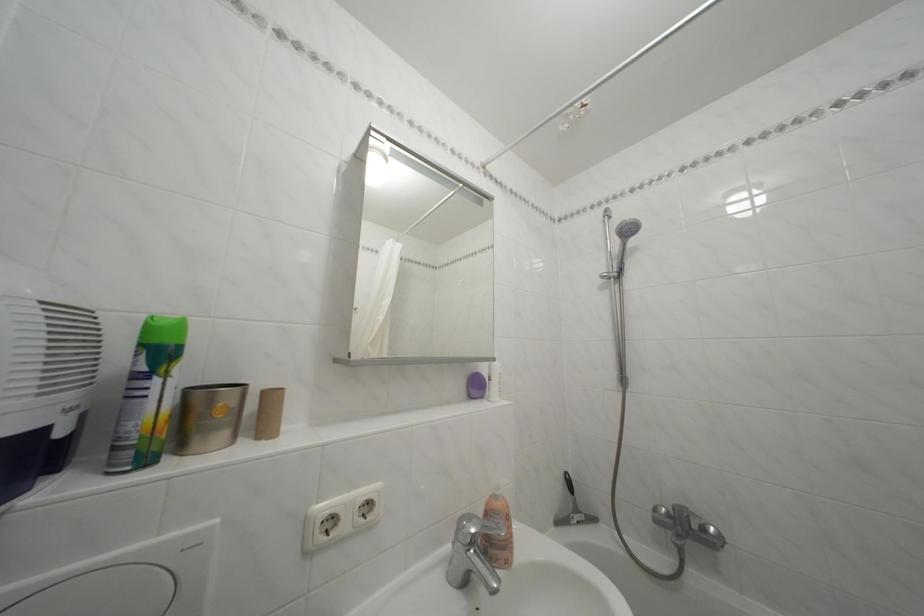
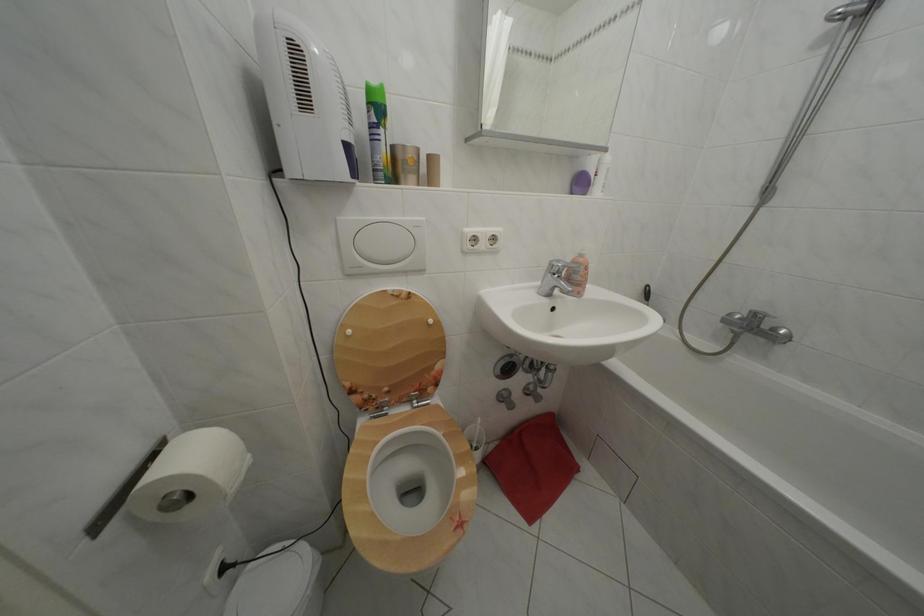
The point at (150, 351) is marked in the first image. Where is the corresponding point in the second image?

(378, 110)